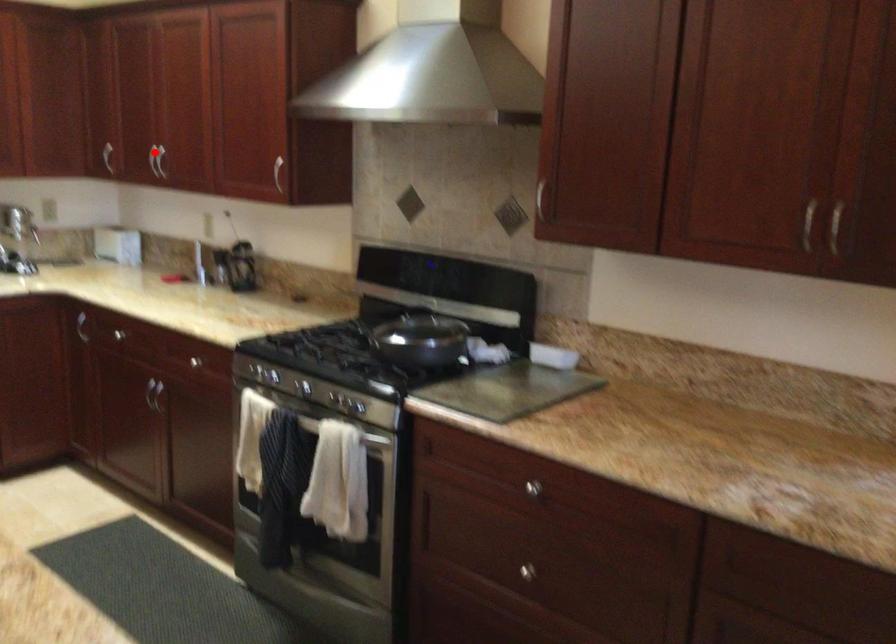
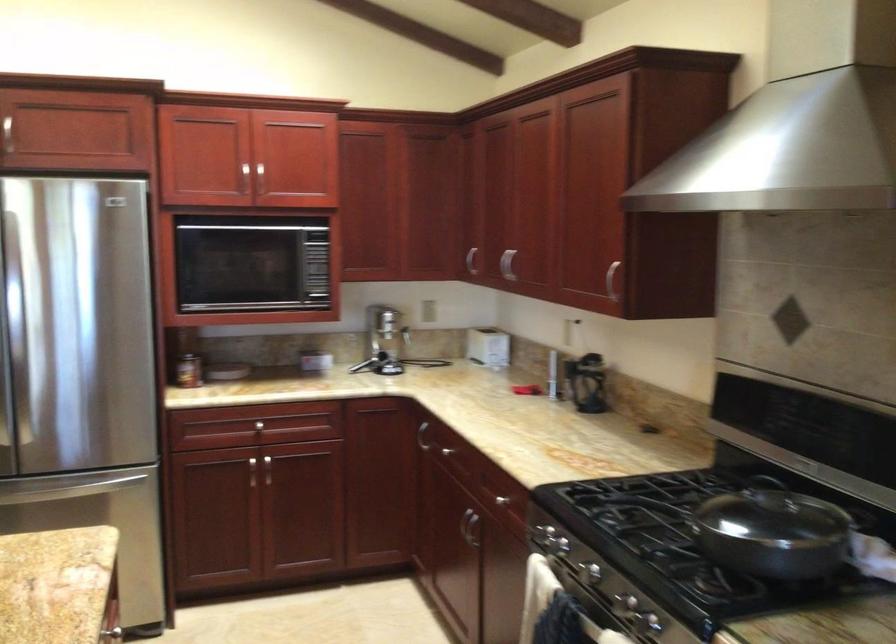
Question: I am providing you with two images of the same scene from different viewpoints. In image1, a red point is highlighted. Considering the same 3D point in image2, which of the following is correct?

Choices:
 (A) It is closer
 (B) It is farther

Answer: (A)